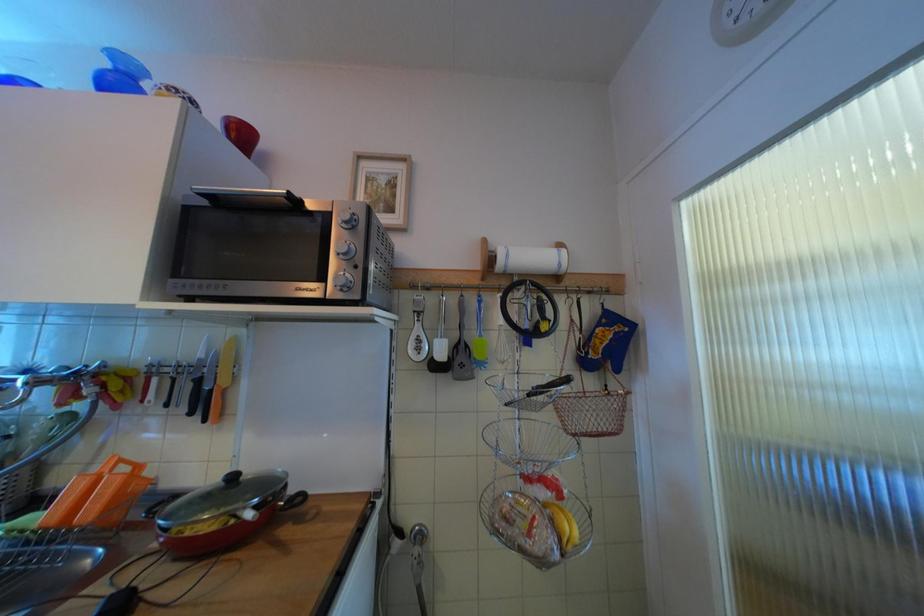
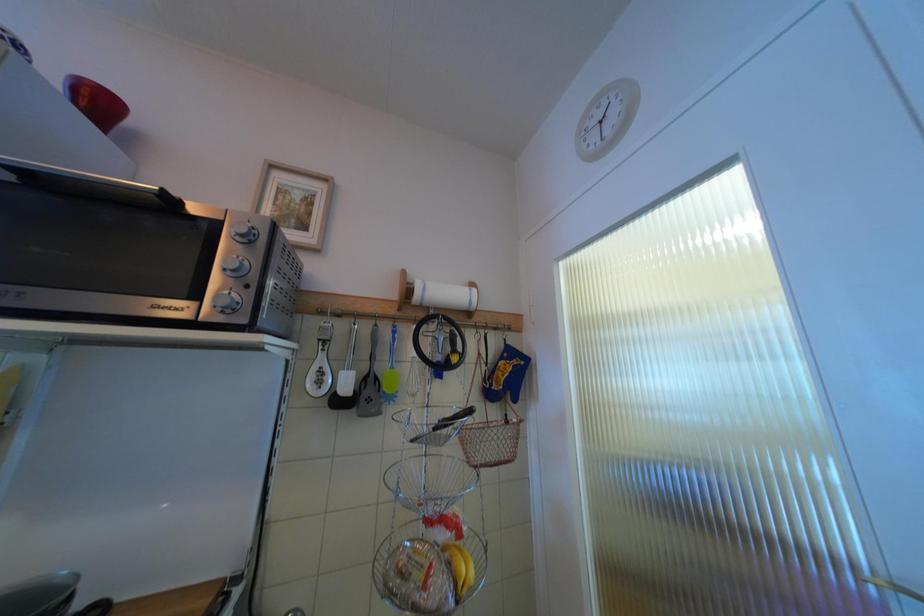
Question: Based on the continuous images, in which direction is the camera rotating? Reply with the corresponding letter.

Choices:
 (A) Left
 (B) Right
 (C) Up
 (D) Down

Answer: (B)